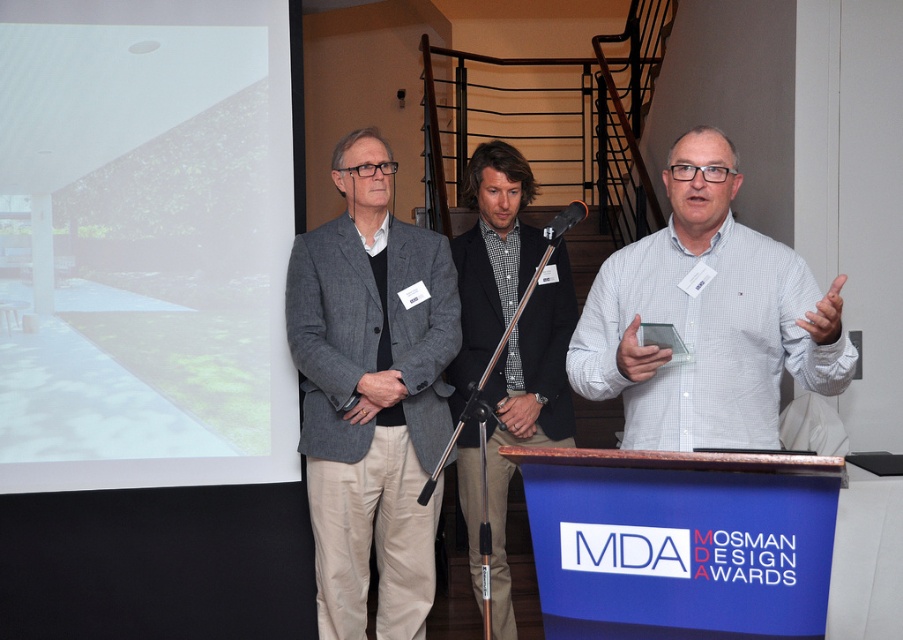
You are an event organizer setting up a presentation. You have a white checkered shirt at center and a white matte projection screen at upper left. Which object has a greater width?

The white matte projection screen at upper left has a greater width than the white checkered shirt at center according to the description.

You are an event photographer at the MDA MOSMAN DESIGN AWARDS. You need to capture a closeup shot of the white checkered shirt at center and the checkered fabric shirt at center. Which one should you focus on if you want to ensure the shirt with the shorter height is in focus?

The white checkered shirt at center has a lesser height compared to the checkered fabric shirt at center, so you should focus on the white checkered shirt at center to ensure the shorter one is in focus.